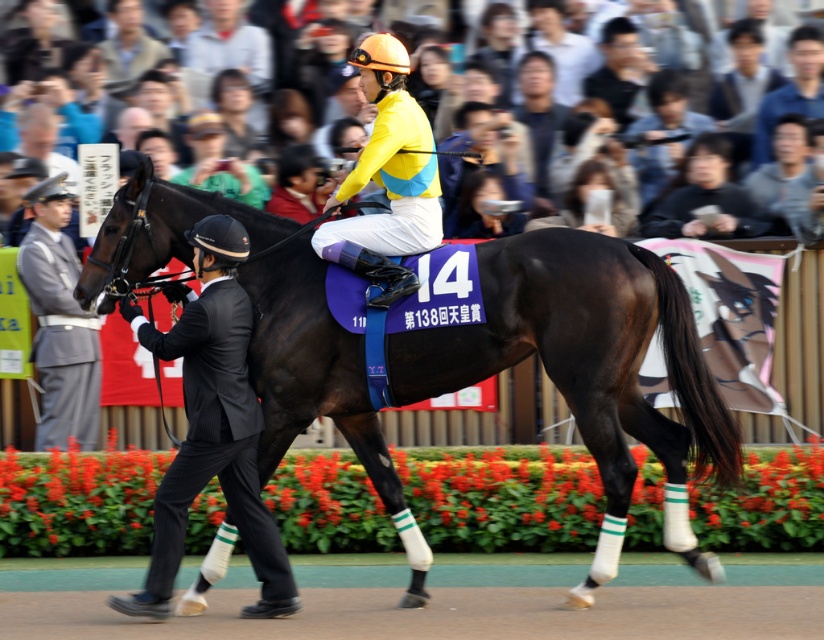
In the scene shown: Does dirt track at center have a greater height compared to smooth skin crowd at upper center?

No, dirt track at center is not taller than smooth skin crowd at upper center.

Measure the distance between dirt track at center and camera.

10.61 meters

Where is `dirt track at center`? The image size is (824, 640). dirt track at center is located at coordinates (443, 614).

Where is `dirt track at center`? The image size is (824, 640). dirt track at center is located at coordinates (443, 614).

Which is more to the right, yellow matte/jersey at center or gray uniform at left?

yellow matte/jersey at center is more to the right.

Can you confirm if yellow matte/jersey at center is smaller than gray uniform at left?

Yes.

You are a GUI agent. You are given a task and a screenshot of the screen. Output one action in this format:
    pyautogui.click(x=<x>, y=<y>)
    Task: Click on the yellow matte/jersey at center
    This screenshot has width=824, height=640.
    Given the screenshot: What is the action you would take?
    pyautogui.click(x=387, y=179)

Can you confirm if shiny dark brown horse at center is smaller than black suit at left?

Actually, shiny dark brown horse at center might be larger than black suit at left.

Is point (691, 365) farther from camera compared to point (258, 529)?

That is False.

The image size is (824, 640). I want to click on shiny dark brown horse at center, so click(584, 358).